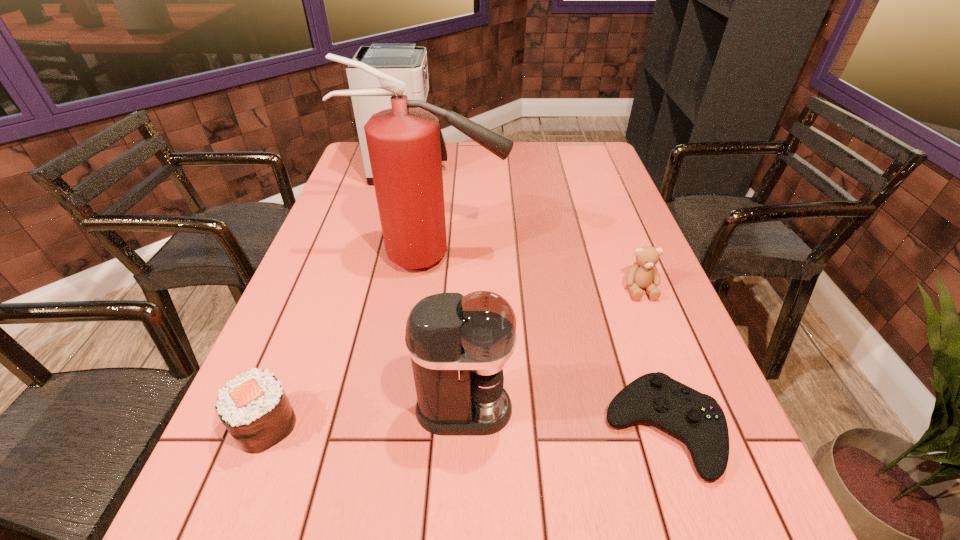
Find the location of a particular element. vacant area between the fifth shortest object and the fourth nearest object is located at coordinates click(x=525, y=230).

I want to click on free space between the teddy bear and the farther coffee maker, so click(525, 230).

Identify the location of vacant area that lies between the nearer coffee maker and the sushi. The height and width of the screenshot is (540, 960). (365, 416).

Identify the location of vacant area that lies between the farther coffee maker and the shorter coffee maker. (438, 289).

Select which object appears as the fifth closest to the shortest object. Please provide its 2D coordinates. Your answer should be formatted as a tuple, i.e. [(x, y)], where the tuple contains the x and y coordinates of a point satisfying the conditions above.

[(406, 61)]

You are a GUI agent. You are given a task and a screenshot of the screen. Output one action in this format:
    pyautogui.click(x=<x>, y=<y>)
    Task: Click on the object that is the third nearest to the fire extinguisher
    The width and height of the screenshot is (960, 540).
    Given the screenshot: What is the action you would take?
    pyautogui.click(x=458, y=345)

The width and height of the screenshot is (960, 540). Find the location of `vacant position in the image that satisfies the following two spatial constraints: 1. place cup under the spout of the nearer coffee maker; 2. on the front side of the sushi`. vacant position in the image that satisfies the following two spatial constraints: 1. place cup under the spout of the nearer coffee maker; 2. on the front side of the sushi is located at coordinates (464, 424).